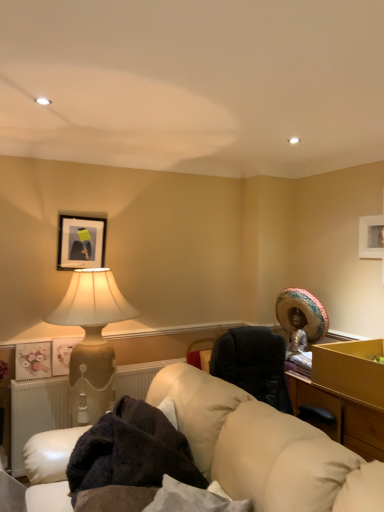
Question: Does white radiator at lower left turn towards matte gold picture frame at left, which ranks as the second picture frame in top-to-bottom order?

Choices:
 (A) yes
 (B) no

Answer: (B)

Question: Considering the relative positions of white radiator at lower left and matte gold picture frame at left, which is the 2th picture frame in bottom-to-top order, in the image provided, is white radiator at lower left in front of matte gold picture frame at left, which is the 2th picture frame in bottom-to-top order,?

Choices:
 (A) no
 (B) yes

Answer: (B)

Question: From the image's perspective, is white radiator at lower left located beneath matte gold picture frame at left, which ranks as the second picture frame in top-to-bottom order?

Choices:
 (A) yes
 (B) no

Answer: (A)

Question: Is white radiator at lower left bigger than matte gold picture frame at left, which is the 2th picture frame in bottom-to-top order?

Choices:
 (A) yes
 (B) no

Answer: (A)

Question: Can you confirm if white radiator at lower left is smaller than matte gold picture frame at left, which is the 2th picture frame in bottom-to-top order?

Choices:
 (A) yes
 (B) no

Answer: (B)

Question: In terms of height, does matte black picture frame at upper left, placed as the 3th picture frame when sorted from bottom to top, look taller or shorter compared to leather couch at lower center?

Choices:
 (A) tall
 (B) short

Answer: (B)

Question: Do you think matte black picture frame at upper left, the 1th picture frame positioned from the top, is within leather couch at lower center, or outside of it?

Choices:
 (A) inside
 (B) outside

Answer: (B)

Question: Would you say matte black picture frame at upper left, the 1th picture frame positioned from the top, is to the left or to the right of leather couch at lower center in the picture?

Choices:
 (A) left
 (B) right

Answer: (A)

Question: From a real-world perspective, is matte black picture frame at upper left, the 1th picture frame positioned from the top, above or below leather couch at lower center?

Choices:
 (A) below
 (B) above

Answer: (B)

Question: Is point (231, 466) positioned closer to the camera than point (13, 403)?

Choices:
 (A) closer
 (B) farther

Answer: (A)

Question: Is leather couch at lower center inside the boundaries of white radiator at lower left, or outside?

Choices:
 (A) outside
 (B) inside

Answer: (A)

Question: From a real-world perspective, is leather couch at lower center physically located above or below white radiator at lower left?

Choices:
 (A) above
 (B) below

Answer: (A)

Question: Is leather couch at lower center in front of or behind white radiator at lower left in the image?

Choices:
 (A) front
 (B) behind

Answer: (A)

Question: Is matte gold picture frame at left, which ranks as the second picture frame in top-to-bottom order, wider or thinner than matte floral print at left, which is counted as the 3th picture frame, starting from the top?

Choices:
 (A) thin
 (B) wide

Answer: (A)

Question: Do you think matte gold picture frame at left, which ranks as the second picture frame in top-to-bottom order, is within matte floral print at left, which appears as the 1th picture frame when ordered from the bottom, or outside of it?

Choices:
 (A) outside
 (B) inside

Answer: (A)